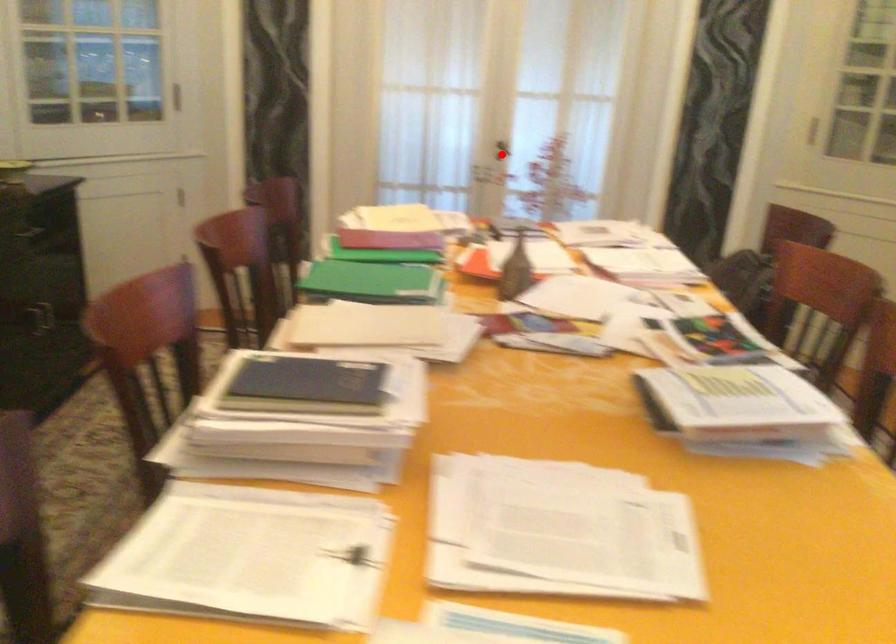
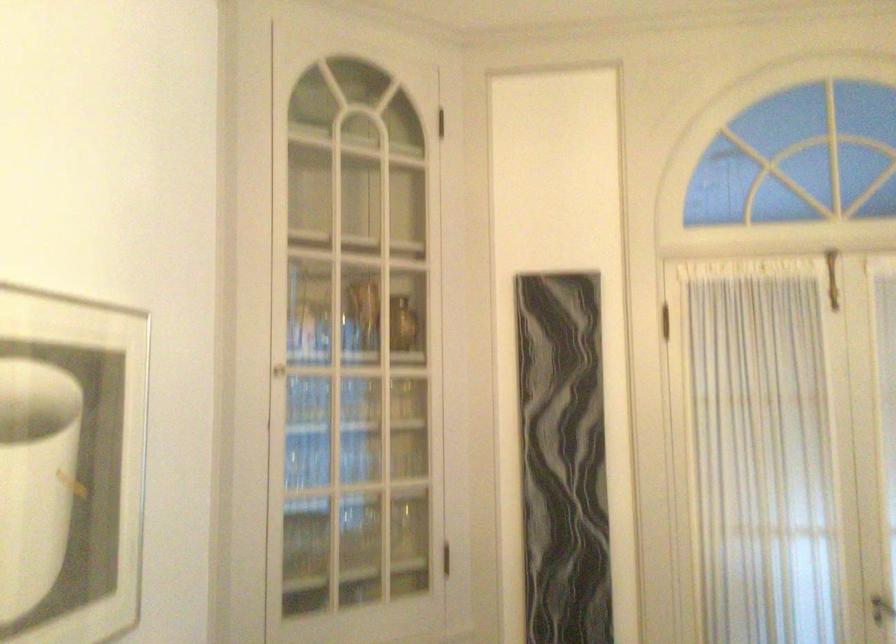
The point at the highlighted location is marked in the first image. Where is the corresponding point in the second image?

(882, 609)